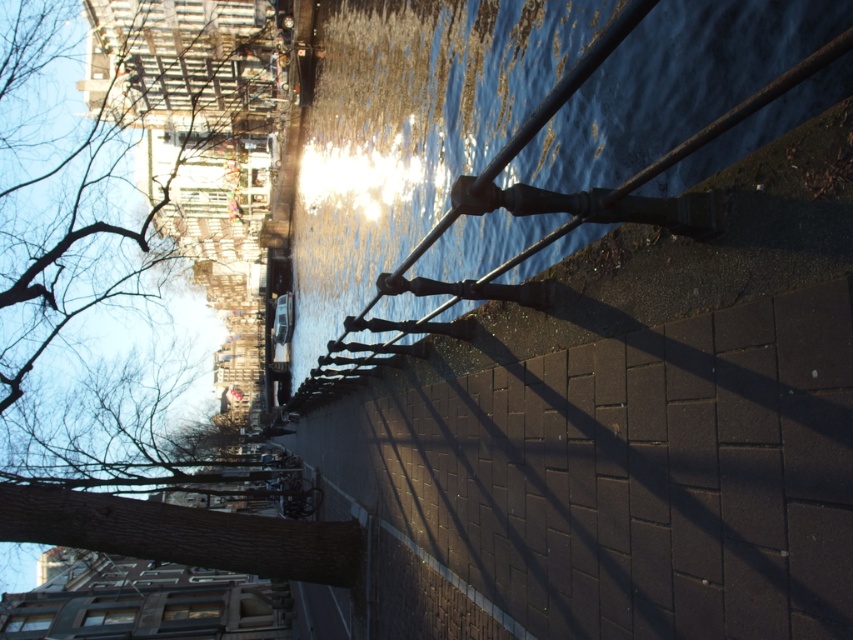
Question: Does glossy water at center have a smaller size compared to brown rough tree at upper left?

Choices:
 (A) yes
 (B) no

Answer: (A)

Question: Is glossy water at center behind brown rough tree at upper left?

Choices:
 (A) yes
 (B) no

Answer: (B)

Question: Among these points, which one is nearest to the camera?

Choices:
 (A) (380, 208)
 (B) (125, 225)

Answer: (A)

Question: Can you confirm if glossy water at center is bigger than brown rough tree at upper left?

Choices:
 (A) yes
 (B) no

Answer: (B)

Question: Which point is closer to the camera?

Choices:
 (A) (123, 3)
 (B) (325, 145)

Answer: (B)